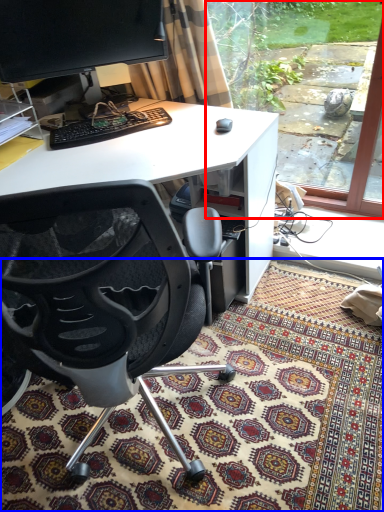
Question: Which point is further to the camera, window screen (highlighted by a red box) or mat (highlighted by a blue box)?

Choices:
 (A) window screen
 (B) mat

Answer: (A)